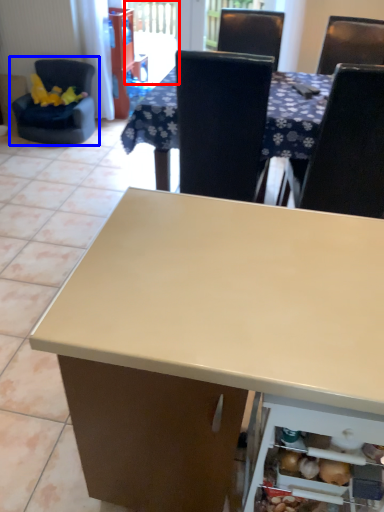
Question: Which point is closer to the camera, screen door (highlighted by a red box) or chair (highlighted by a blue box)?

Choices:
 (A) screen door
 (B) chair

Answer: (B)